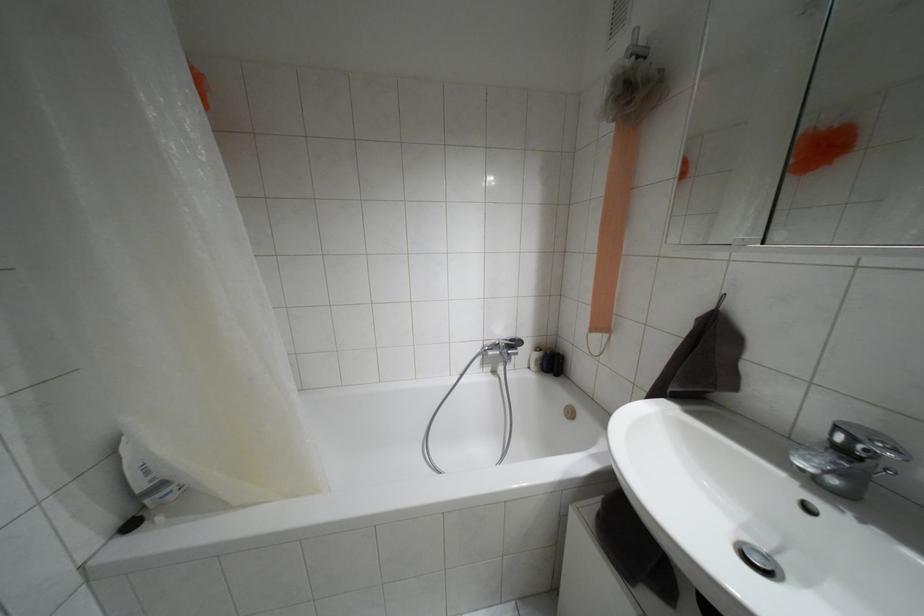
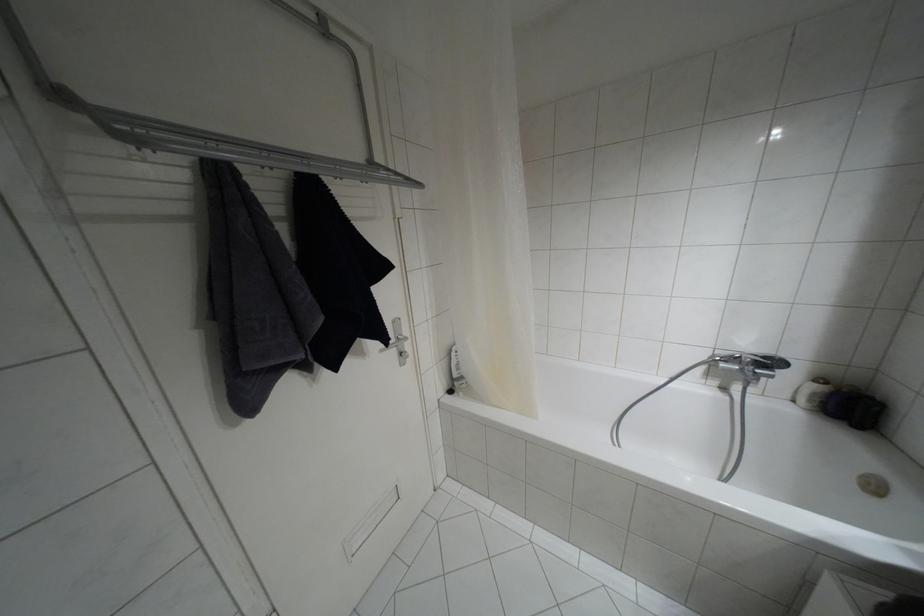
Locate, in the second image, the point that corresponds to [537,347] in the first image.

(820, 379)